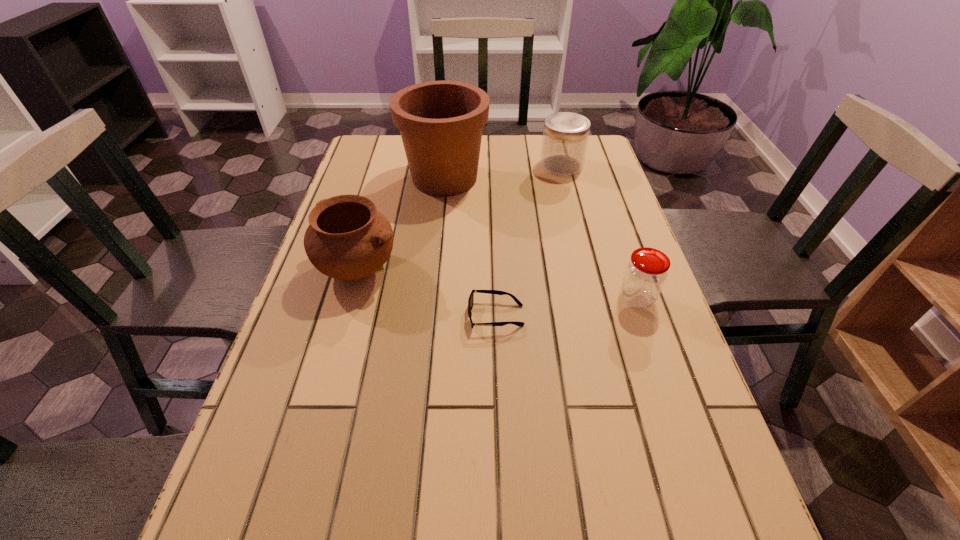
This screenshot has width=960, height=540. In order to click on vacant area at the left edge in this screenshot , I will do `click(396, 184)`.

In the image, there is a desktop. At what (x,y) coordinates should I click in order to perform the action: click on free space at the right edge. Please return your answer as a coordinate pair (x, y). Looking at the image, I should click on (561, 179).

Where is `free space between the shortest object and the flowerpot`? This screenshot has width=960, height=540. free space between the shortest object and the flowerpot is located at coordinates (470, 247).

Identify the location of free space between the flowerpot and the shortest object. The height and width of the screenshot is (540, 960). (470, 247).

Where is `vacant space that's between the nearer jar and the shortest object`? vacant space that's between the nearer jar and the shortest object is located at coordinates point(566,307).

This screenshot has height=540, width=960. What are the coordinates of `vacant area that lies between the tallest object and the farther jar` in the screenshot? It's located at (503, 172).

Where is `vacant point located between the sunglasses and the nearer jar`? This screenshot has width=960, height=540. vacant point located between the sunglasses and the nearer jar is located at coordinates (566, 307).

Where is `vacant area that lies between the farther jar and the tallest object`? vacant area that lies between the farther jar and the tallest object is located at coordinates (503, 172).

I want to click on vacant area that lies between the shortest object and the farther jar, so click(x=529, y=240).

The image size is (960, 540). I want to click on free space between the farther jar and the pottery, so click(x=461, y=217).